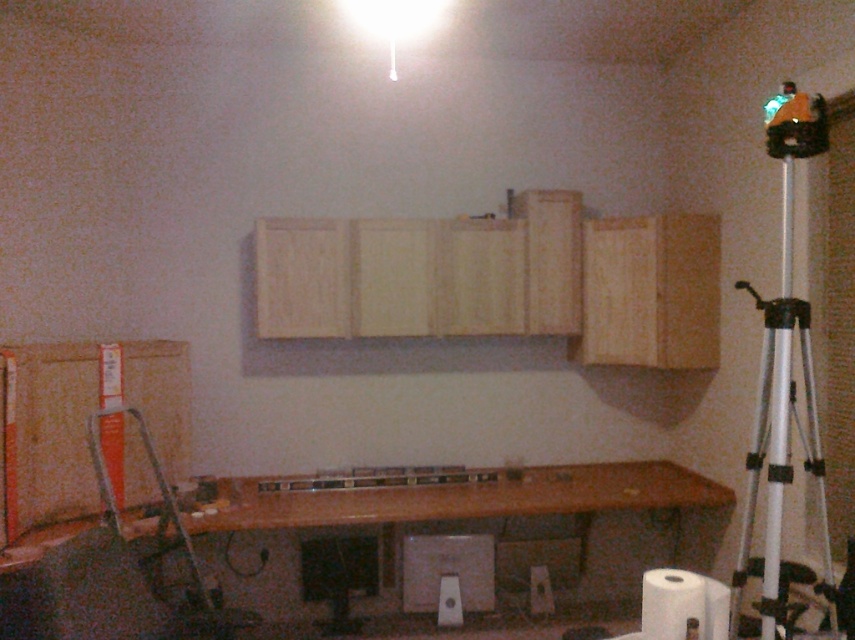
Who is higher up, wooden at lower center or silver metallic tripod at right?

Positioned higher is silver metallic tripod at right.

This screenshot has height=640, width=855. Identify the location of wooden at lower center. (467, 499).

This screenshot has width=855, height=640. I want to click on wooden at lower center, so click(467, 499).

Who is lower down, silver metallic tripod at right or white plastic speaker at center?

white plastic speaker at center is lower down.

Which is more to the left, silver metallic tripod at right or white plastic speaker at center?

white plastic speaker at center is more to the left.

Measure the distance between silver metallic tripod at right and camera.

The distance of silver metallic tripod at right from camera is 2.31 meters.

Locate an element on the screen. This screenshot has width=855, height=640. silver metallic tripod at right is located at coordinates (779, 458).

Image resolution: width=855 pixels, height=640 pixels. Describe the element at coordinates (467, 499) in the screenshot. I see `wooden at lower center` at that location.

In the scene shown: Does wooden at lower center appear over white plastic speaker at center?

Yes, wooden at lower center is above white plastic speaker at center.

Which is behind, point (391, 524) or point (411, 554)?

The point (411, 554) is behind.

You are a GUI agent. You are given a task and a screenshot of the screen. Output one action in this format:
    pyautogui.click(x=<x>, y=<y>)
    Task: Click on the wooden at lower center
    This screenshot has width=855, height=640.
    Given the screenshot: What is the action you would take?
    pos(467,499)